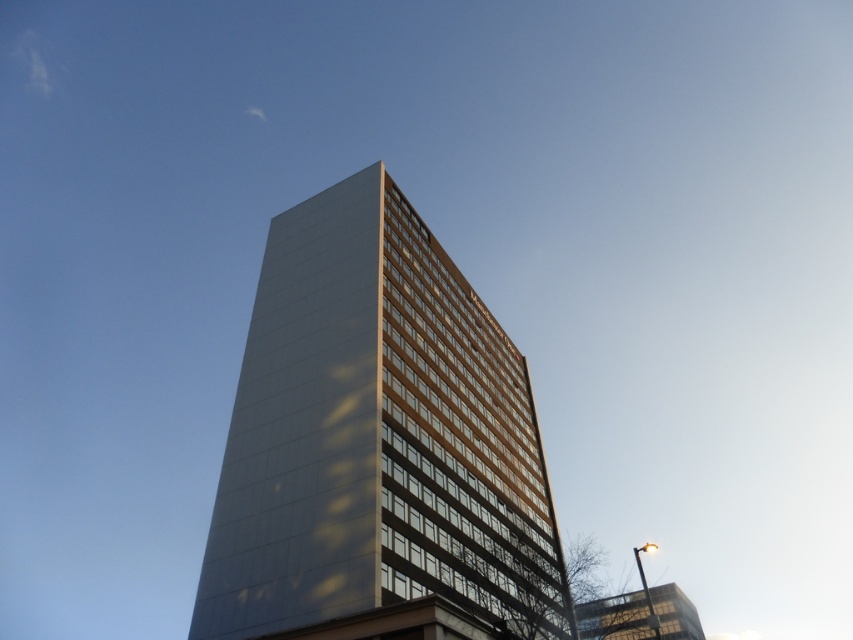
Is matte glass tower at center wider than clear glass building at lower right?

Incorrect, matte glass tower at center's width does not surpass clear glass building at lower right's.

Who is more forward, (393, 188) or (685, 598)?

Positioned in front is point (393, 188).

Locate an element on the screen. This screenshot has width=853, height=640. matte glass tower at center is located at coordinates (378, 445).